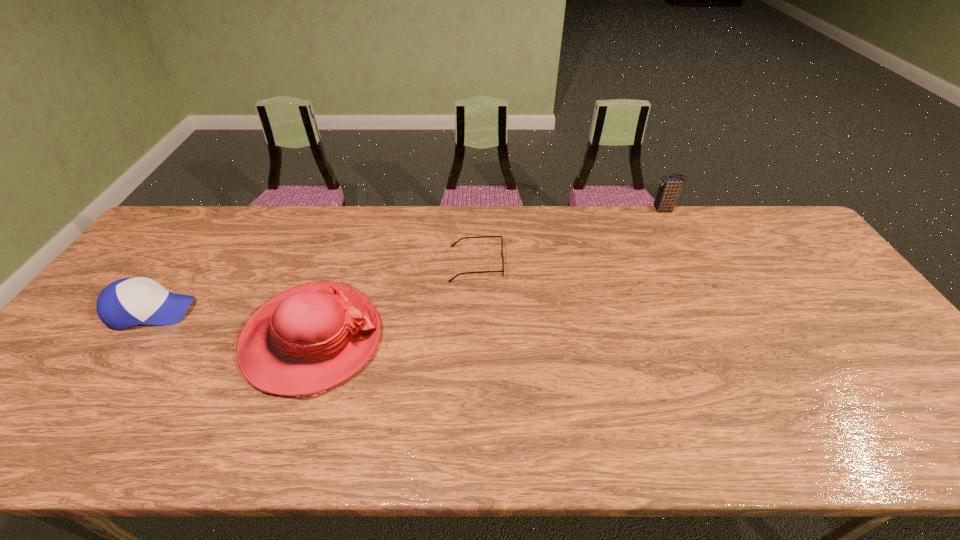
Where is `the farthest object`? The height and width of the screenshot is (540, 960). the farthest object is located at coordinates (669, 188).

Where is `clutch bag`? The height and width of the screenshot is (540, 960). clutch bag is located at coordinates (669, 188).

Locate an element on the screen. hat is located at coordinates (308, 339).

Image resolution: width=960 pixels, height=540 pixels. What are the coordinates of `baseball cap` in the screenshot? It's located at (127, 302).

This screenshot has height=540, width=960. In order to click on the leftmost object in this screenshot , I will do `click(127, 302)`.

The height and width of the screenshot is (540, 960). In order to click on the shortest object in this screenshot , I will do `click(452, 245)`.

Find the location of a particular element. Image resolution: width=960 pixels, height=540 pixels. the third nearest object is located at coordinates (452, 245).

Locate an element on the screen. The height and width of the screenshot is (540, 960). vacant area situated 0.120m with the zip open on the clutch bag is located at coordinates (617, 210).

At what (x,y) coordinates should I click in order to perform the action: click on vacant space located with the zip open on the clutch bag. Please return your answer as a coordinate pair (x, y). The image size is (960, 540). Looking at the image, I should click on (617, 210).

Locate an element on the screen. This screenshot has width=960, height=540. vacant space located with the zip open on the clutch bag is located at coordinates (637, 210).